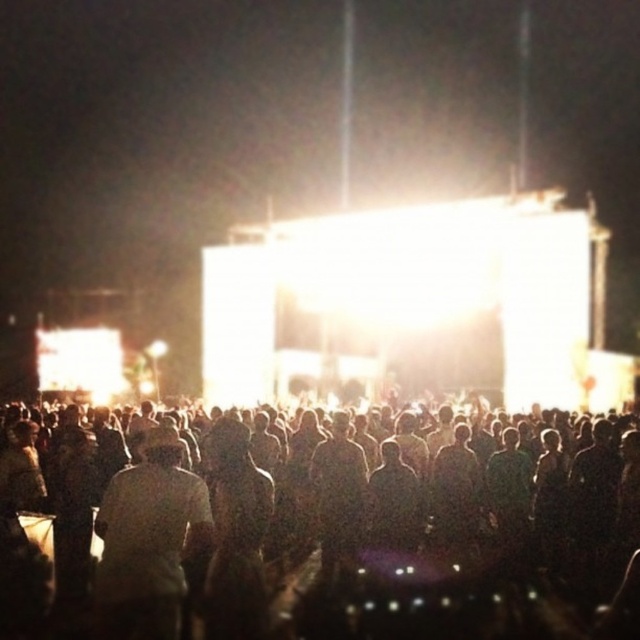
Question: Does dark silhouettes at center have a larger size compared to white matte shirt at center?

Choices:
 (A) yes
 (B) no

Answer: (A)

Question: Among these points, which one is farthest from the camera?

Choices:
 (A) (161, 465)
 (B) (224, 493)

Answer: (B)

Question: Which object appears closest to the camera in this image?

Choices:
 (A) dark silhouettes at center
 (B) white matte shirt at center

Answer: (B)

Question: Is dark silhouettes at center wider than white matte shirt at center?

Choices:
 (A) no
 (B) yes

Answer: (B)

Question: Is dark silhouettes at center above white matte shirt at center?

Choices:
 (A) no
 (B) yes

Answer: (B)